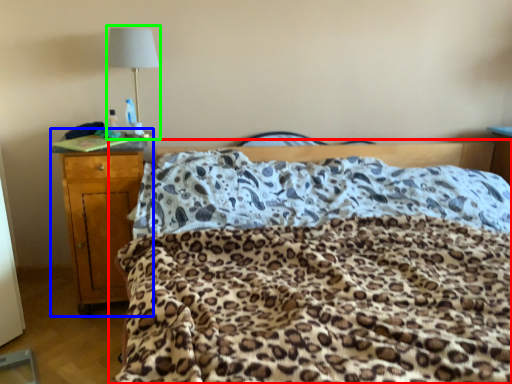
Question: Considering the real-world distances, which object is farthest from bed (highlighted by a red box)? nightstand (highlighted by a blue box) or lamp (highlighted by a green box)?

Choices:
 (A) nightstand
 (B) lamp

Answer: (B)